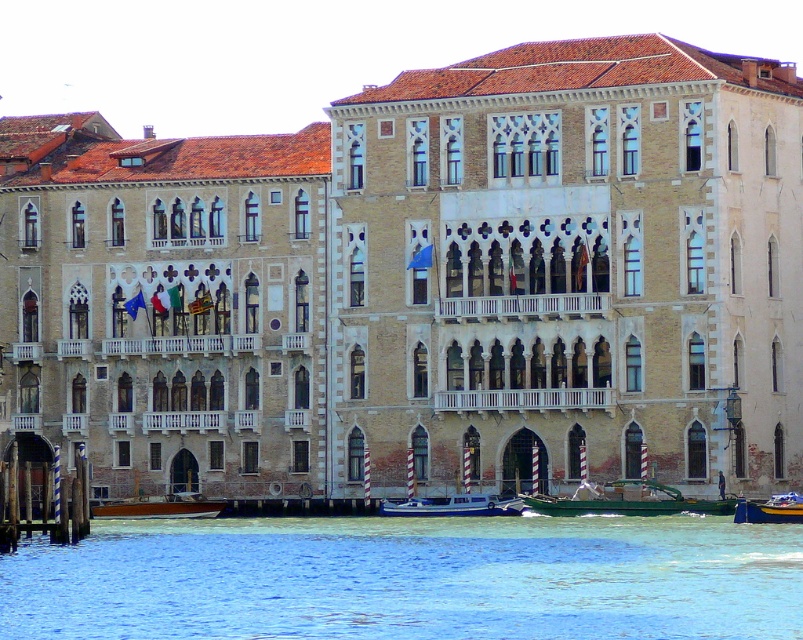
Looking at this image, you are a tour guide leading a group along the canal. You want to ensure that a new boat, which is 20 meters long, can safely pass between the wooden polished boat at lower left and the metallic blue boat at lower right. Can the boat fit through the space between them?

The distance between the wooden polished boat at lower left and the metallic blue boat at lower right is 20.11 meters. Since the new boat is 20 meters long, it can safely pass through the space as there is enough clearance.